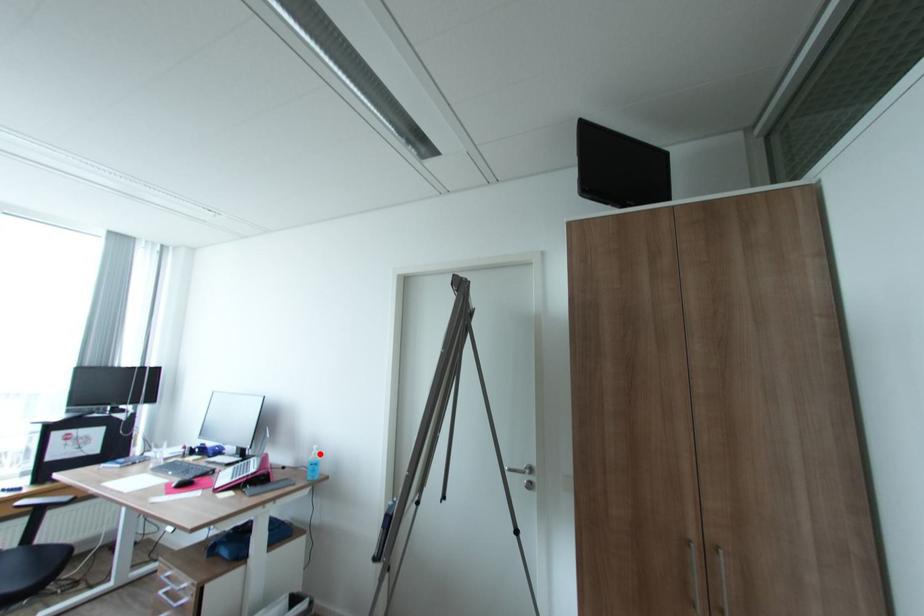
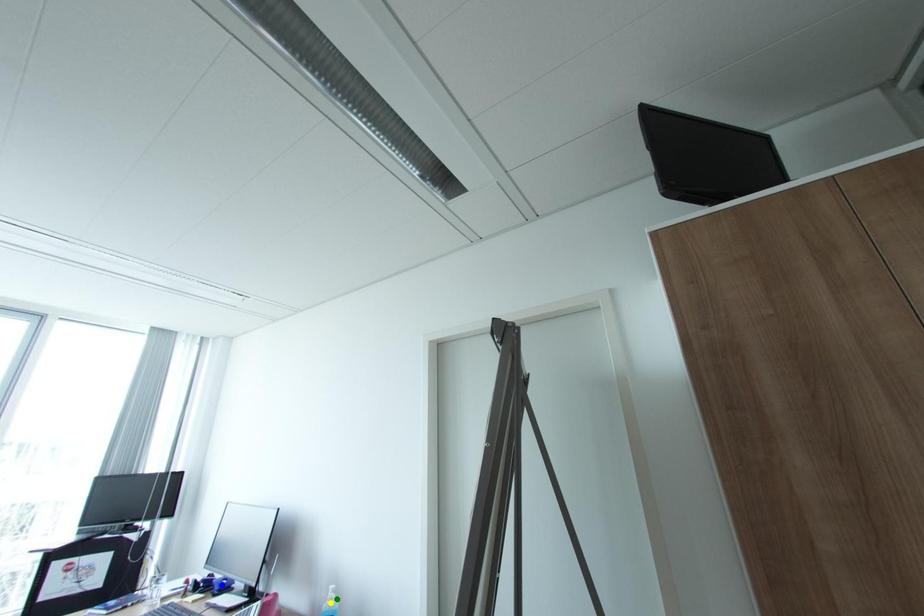
Question: I am providing you with two images of the same scene from different viewpoints. A red point is marked on the first image. You are given multiple points on the second image. Can you choose the point in image 2 that corresponds to the point in image 1?

Choices:
 (A) blue point
 (B) yellow point
 (C) green point

Answer: (C)